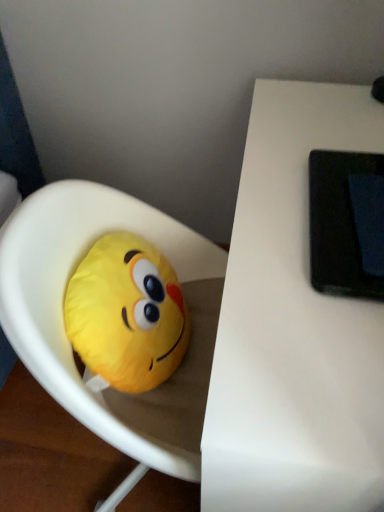
This screenshot has height=512, width=384. Identify the location of vacant area situated to the left side of black matte tablet at upper right. (270, 241).